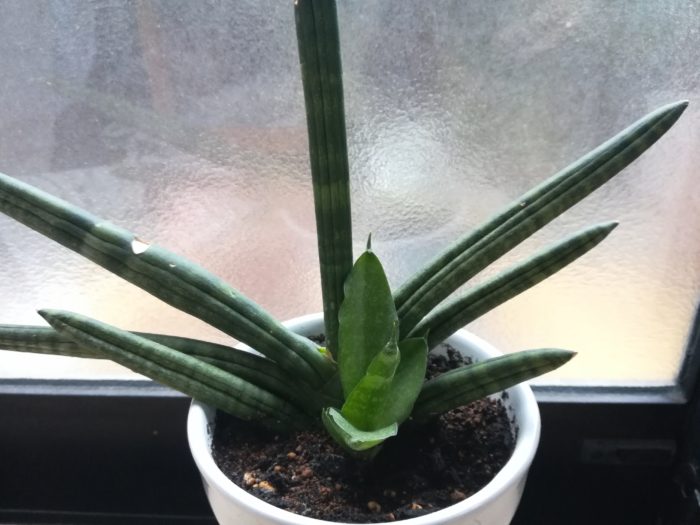
Identify the location of window. (157, 130).